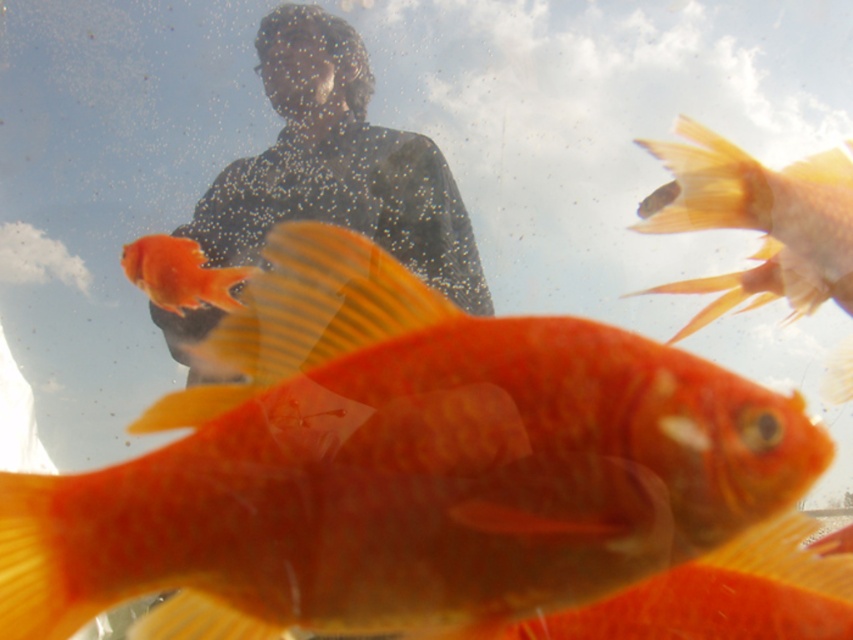
Who is positioned more to the left, shiny orange fish at center or matte black shirt at upper center?

From the viewer's perspective, matte black shirt at upper center appears more on the left side.

Who is more forward, (236, 493) or (340, 52)?

Point (236, 493) is more forward.

Looking at this image, who is more forward, (473, 368) or (431, 269)?

Point (473, 368)

Where is `shiny orange fish at center`? shiny orange fish at center is located at coordinates (401, 467).

Who is higher up, shiny orange fish at center or orange matte goldfish at center?

Positioned higher is orange matte goldfish at center.

Does shiny orange fish at center have a lesser width compared to orange matte goldfish at center?

In fact, shiny orange fish at center might be wider than orange matte goldfish at center.

Does point (287, 349) come behind point (822, 284)?

No, (287, 349) is closer to viewer.

The width and height of the screenshot is (853, 640). Find the location of `shiny orange fish at center`. shiny orange fish at center is located at coordinates (401, 467).

Does orange matte goldfish at center appear under matte orange goldfish at center?

No, orange matte goldfish at center is not below matte orange goldfish at center.

Between point (741, 193) and point (154, 266), which one is positioned in front?

Point (741, 193) is more forward.

Does point (822, 163) lie behind point (161, 298)?

That is False.

Locate an element on the screen. This screenshot has height=640, width=853. orange matte goldfish at center is located at coordinates (764, 211).